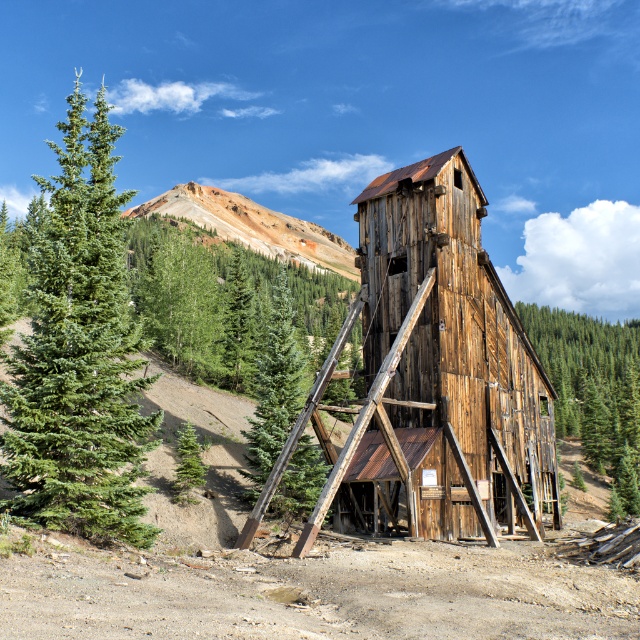
You are standing at the entrance of the historic mining shaft and want to locate the green matte tree at center. According to the coordinates, where should you look relative to your position?

The green matte tree at center is located at coordinates point (x=273, y=392), which means it is positioned to the right and slightly above your current viewpoint.

You are a hiker who has just arrived at the base of the mountain. You see the weathered wood tower at center. Can you estimate its exact location using coordinates?

The weathered wood tower at center is located at coordinates point (452, 353).

You are standing at the base of the historic mining shaft structure. You notice a specific point marked at coordinates point (381, 369). If you want to place a safety barrier 30 meters away from your current position towards that point, will the barrier be placed beyond the point or before it?

The point (381, 369) is 29.74 meters from the viewer. Since the safety barrier is to be placed 30 meters away, the barrier will be placed just beyond the point as it is slightly farther than the point itself.